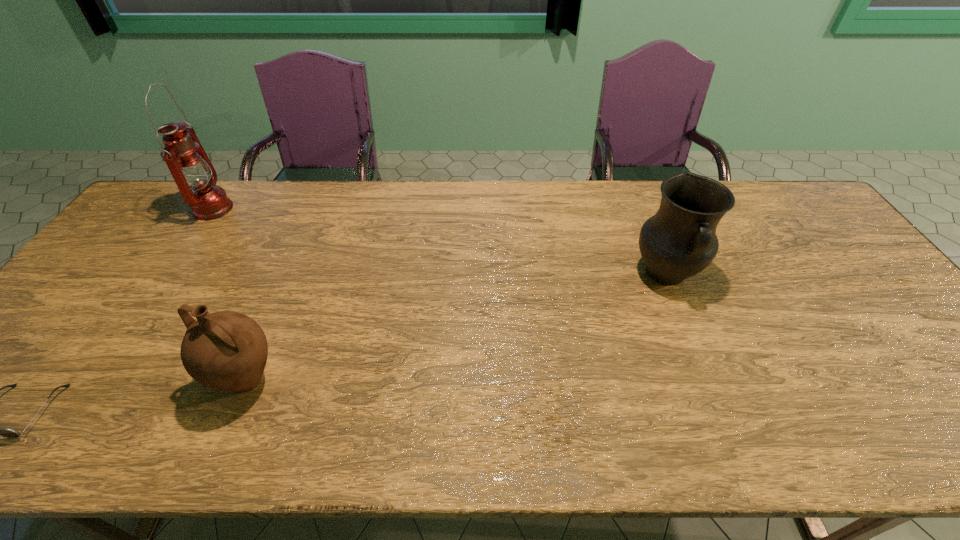
Where is `object present at the near edge`? object present at the near edge is located at coordinates (226, 350).

Find the location of a particular element. The height and width of the screenshot is (540, 960). object present at the left edge is located at coordinates (192, 170).

You are a GUI agent. You are given a task and a screenshot of the screen. Output one action in this format:
    pyautogui.click(x=<x>, y=<y>)
    Task: Click on the object present at the far left corner
    
    Given the screenshot: What is the action you would take?
    pyautogui.click(x=192, y=170)

Where is `vacant region at the far edge of the desktop`? This screenshot has width=960, height=540. vacant region at the far edge of the desktop is located at coordinates (435, 200).

I want to click on vacant space at the near edge of the desktop, so pyautogui.click(x=301, y=445).

At what (x,y) coordinates should I click in order to perform the action: click on free space at the left edge of the desktop. Please return your answer as a coordinate pair (x, y). The image size is (960, 540). Looking at the image, I should click on (48, 326).

The height and width of the screenshot is (540, 960). I want to click on free spot at the right edge of the desktop, so click(x=893, y=324).

You are a GUI agent. You are given a task and a screenshot of the screen. Output one action in this format:
    pyautogui.click(x=<x>, y=<y>)
    Task: Click on the vacant space at the far right corner of the desktop
    This screenshot has width=960, height=540.
    Given the screenshot: What is the action you would take?
    pyautogui.click(x=785, y=218)

I want to click on free spot between the farthest object and the second object from right to left, so click(230, 295).

This screenshot has width=960, height=540. I want to click on vacant area between the left pitcher and the farthest object, so click(x=230, y=295).